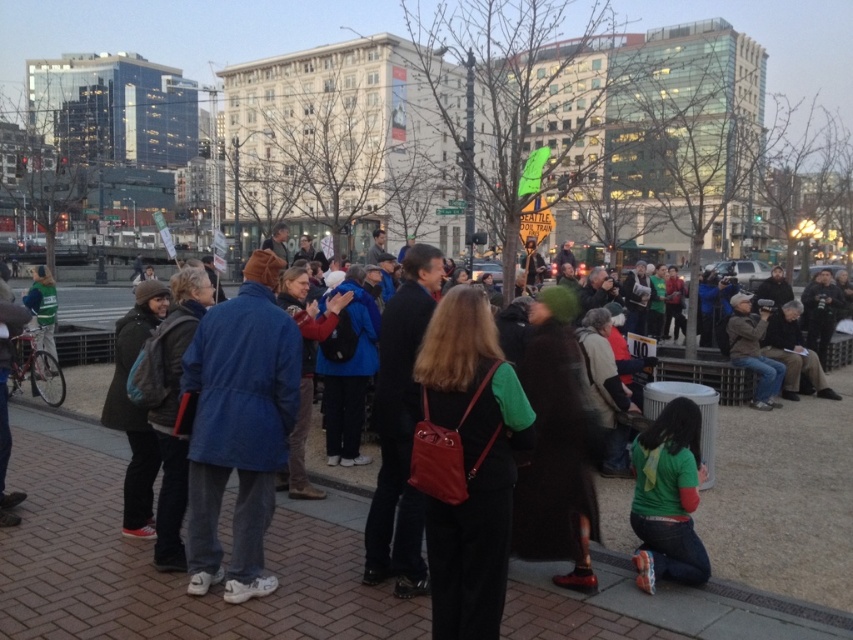
Question: Is blue fabric coat at center further to the viewer compared to green matte shirt at lower right?

Choices:
 (A) yes
 (B) no

Answer: (B)

Question: Which object is the closest to the green matte shirt at lower right?

Choices:
 (A) matte red backpack at center
 (B) blue fabric coat at center

Answer: (A)

Question: Does matte red backpack at center appear under green matte shirt at lower right?

Choices:
 (A) yes
 (B) no

Answer: (B)

Question: From the image, what is the correct spatial relationship of matte red backpack at center in relation to green matte shirt at lower right?

Choices:
 (A) right
 (B) left

Answer: (B)

Question: Which object appears closest to the camera in this image?

Choices:
 (A) matte red backpack at center
 (B) green matte shirt at lower right

Answer: (A)

Question: Which of the following is the closest to the observer?

Choices:
 (A) (444, 460)
 (B) (675, 502)
 (C) (194, 580)

Answer: (A)